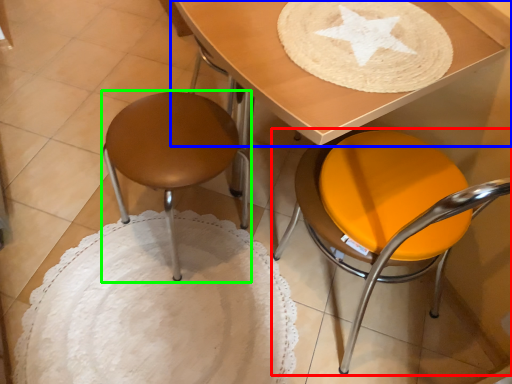
Question: Considering the real-world distances, which object is closest to chair (highlighted by a red box)? table (highlighted by a blue box) or stool (highlighted by a green box).

Choices:
 (A) table
 (B) stool

Answer: (A)